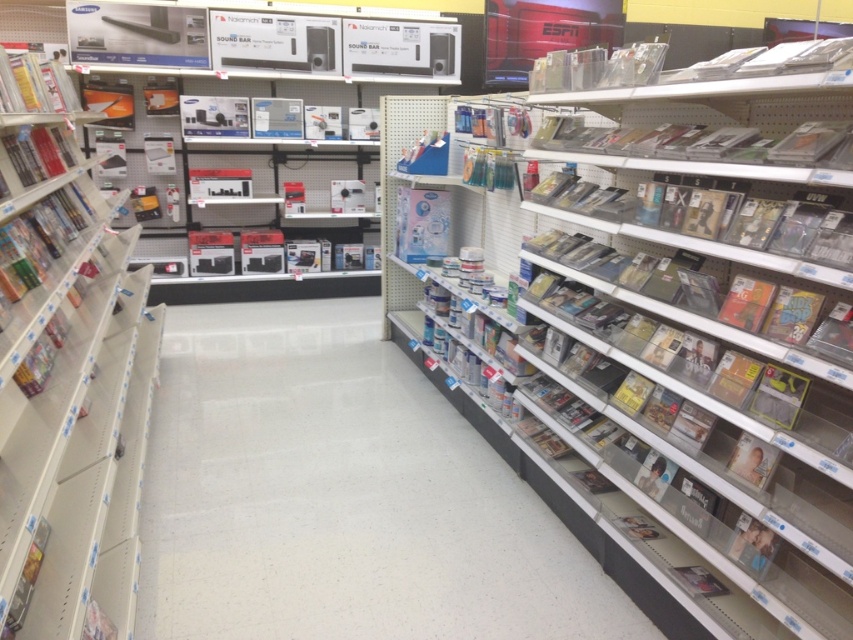
You are standing in the electronics store and want to walk towards the white glossy floor at center. Which direction should you face relative to the metallic silver bookshelf at left?

You should face towards the right side of the metallic silver bookshelf at left because the white glossy floor at center is located to the right of it.

You are a customer in the store and want to reach the CDs on the right shelf. You notice the white glossy floor at center and the metallic silver bookshelf at left. Which object is lower in height?

The white glossy floor at center is located below metallic silver bookshelf at left, so the white glossy floor at center is lower in height.

You are a customer looking for a specific item in the electronics store. You see the clear plastic books at center and the metallic silver bookshelf at left. Which one is higher up in the image?

The clear plastic books at center are higher up in the image since they are positioned above the metallic silver bookshelf at left.